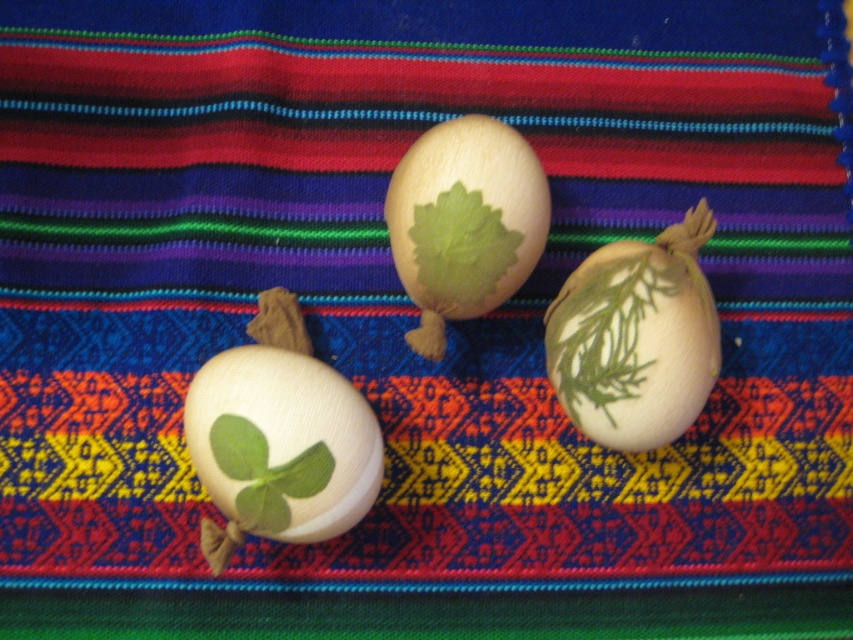
You are an interior designer arranging a display. You have a wooden egg with green leaf at center and a green matte onion at center. Which object should you choose if you want a larger centerpiece for the table?

The wooden egg with green leaf at center is larger in size than the green matte onion at center, so it would be the better choice for a larger centerpiece.

You are an artist who wants to paint a scene based on the image. You need to know the exact location of the wooden egg with green leaf at center. What are its coordinates?

The wooden egg with green leaf at center is located at coordinates point (282,444).

You are looking at the image of the three eggs on the patterned fabric. There are two points marked in the scene. Which of the two points, point (651, 364) or point (463, 289), is closer to you?

Point (651, 364) is closer to the camera than point (463, 289).